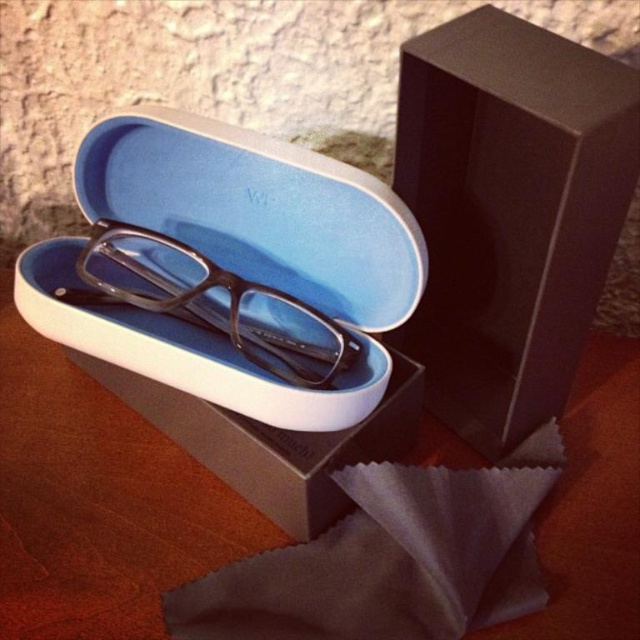
Question: Observing the image, what is the correct spatial positioning of matte black case at center in reference to matte black glasses at center?

Choices:
 (A) left
 (B) right

Answer: (B)

Question: Which object is positioned farthest from the matte black case at center?

Choices:
 (A) matte black box at upper right
 (B) matte black glasses at center

Answer: (A)

Question: Estimate the real-world distances between objects in this image. Which object is farther from the matte black box at upper right?

Choices:
 (A) matte black case at center
 (B) matte black glasses at center

Answer: (B)

Question: Can you confirm if matte black case at center is wider than matte black glasses at center?

Choices:
 (A) yes
 (B) no

Answer: (A)

Question: Is matte black case at center bigger than matte black glasses at center?

Choices:
 (A) yes
 (B) no

Answer: (A)

Question: Which of the following is the closest to the observer?

Choices:
 (A) (288, 500)
 (B) (486, 61)
 (C) (74, 300)

Answer: (B)